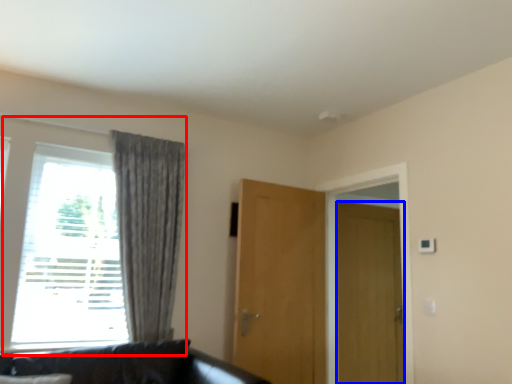
Question: Which object is closer to the camera taking this photo, window (highlighted by a red box) or door (highlighted by a blue box)?

Choices:
 (A) window
 (B) door

Answer: (A)